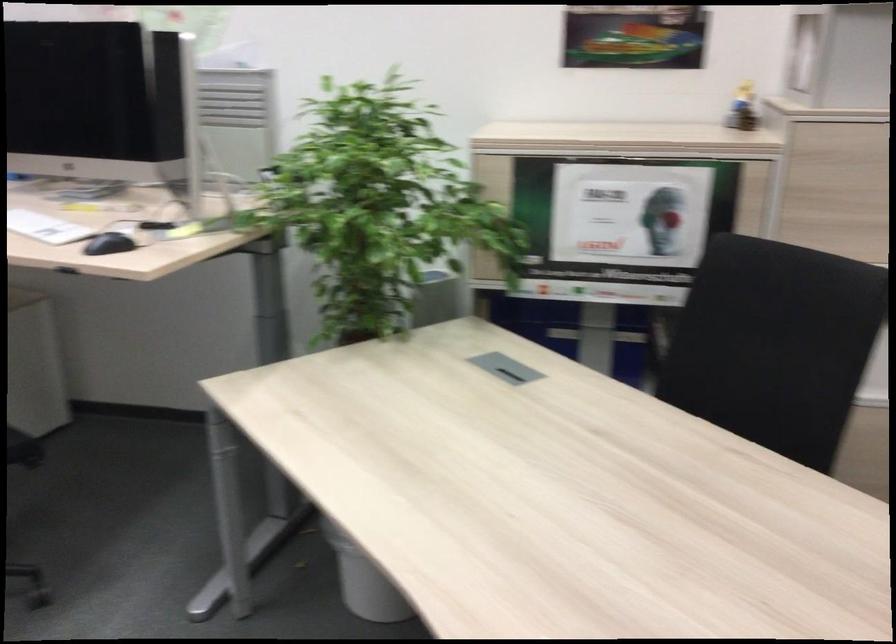
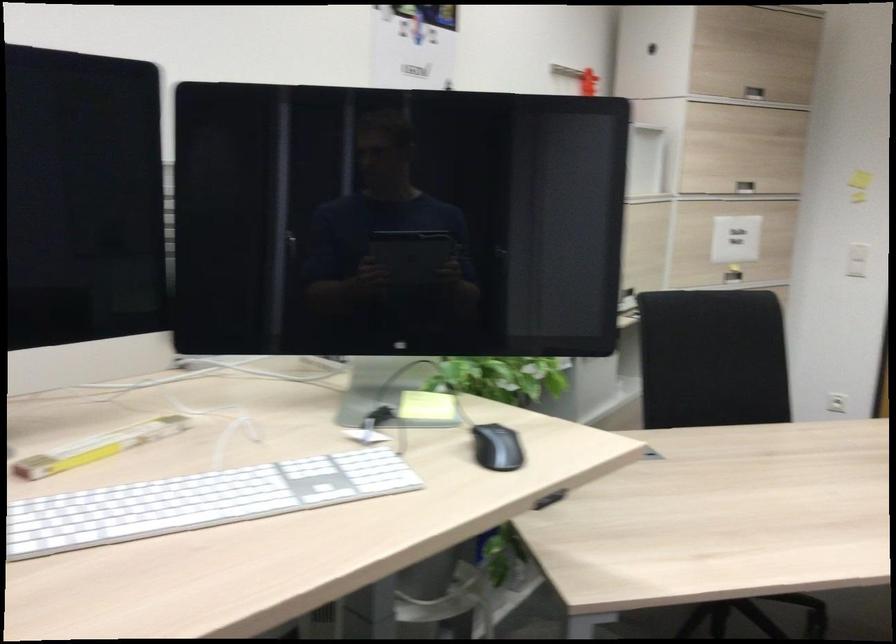
Locate, in the second image, the point that corresponds to point (116, 248) in the first image.

(496, 448)